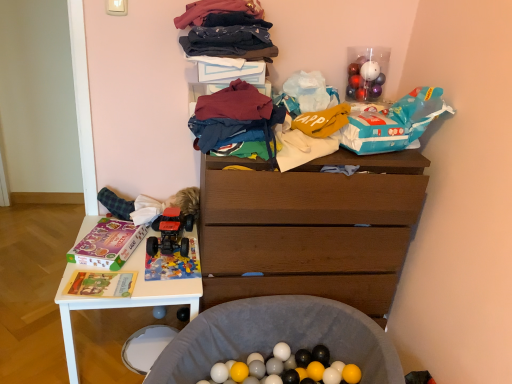
This screenshot has width=512, height=384. Find the location of `free space in front of rubberized red truck at lower left`. free space in front of rubberized red truck at lower left is located at coordinates [162, 271].